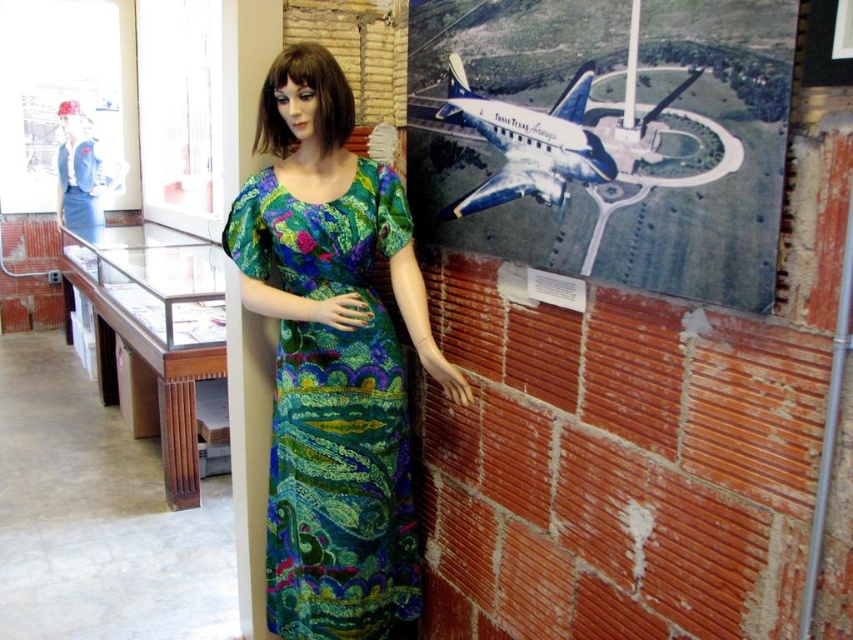
You are an interior designer assessing the layout of this room. You notice the metallic airplane at upper right and the multicolored printed fabric dress at center. Which object occupies a taller vertical space in the room?

The multicolored printed fabric dress at center is taller than the metallic airplane at upper right, so it occupies more vertical space in the room.